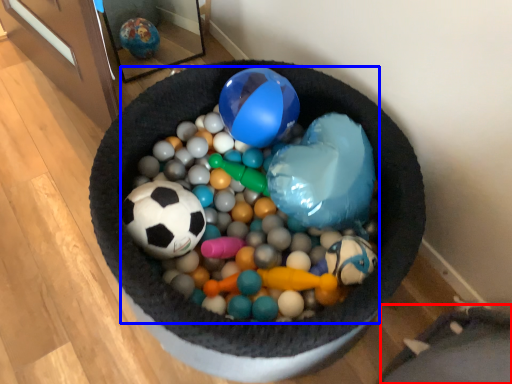
Question: Which point is closer to the camera, bean bag chair (highlighted by a red box) or ball (highlighted by a blue box)?

Choices:
 (A) bean bag chair
 (B) ball

Answer: (B)